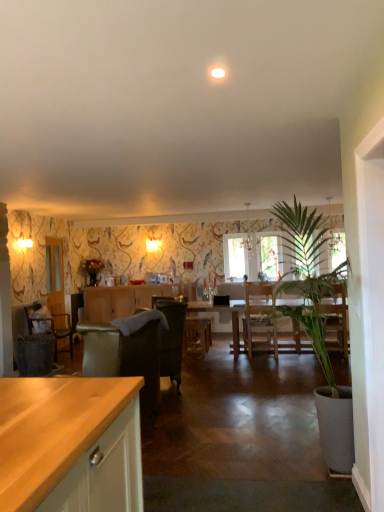
What do you see at coordinates (171, 336) in the screenshot? I see `velvet dark brown armchair at center, placed as the 2th chair when sorted from back to front` at bounding box center [171, 336].

What do you see at coordinates (234, 256) in the screenshot? I see `clear glass window screen at center` at bounding box center [234, 256].

Image resolution: width=384 pixels, height=512 pixels. Describe the element at coordinates (119, 300) in the screenshot. I see `wooden cabinet at center` at that location.

What do you see at coordinates (51, 326) in the screenshot? This screenshot has width=384, height=512. I see `wooden chair at left, positioned as the first chair in left-to-right order` at bounding box center [51, 326].

Describe the element at coordinates (249, 237) in the screenshot. I see `metallic chandelier at center` at that location.

This screenshot has height=512, width=384. Identify the location of clear glass door at left. (56, 286).

Is green leafy plant at right aimed at metallic chandelier at center?

Yes, green leafy plant at right faces towards metallic chandelier at center.

In the scene shown: Is green leafy plant at right to the left of metallic chandelier at center from the viewer's perspective?

Correct, you'll find green leafy plant at right to the left of metallic chandelier at center.

Which is correct: green leafy plant at right is inside metallic chandelier at center, or outside of it?

green leafy plant at right lies outside metallic chandelier at center.

How much distance is there between green leafy plant at right and metallic chandelier at center?

A distance of 3.89 meters exists between green leafy plant at right and metallic chandelier at center.

Consider the image. Which of these two, clear glass window screen at center or wooden dining table at center, stands shorter?

wooden dining table at center.

Between clear glass window screen at center and wooden dining table at center, which one has larger size?

wooden dining table at center.

From a real-world perspective, does clear glass window screen at center stand above wooden dining table at center?

Yes, from a real-world perspective, clear glass window screen at center is over wooden dining table at center

Which of these two, clear glass window screen at center or wooden dining table at center, is thinner?

Thinner between the two is clear glass window screen at center.

From a real-world perspective, is wooden dining table at center physically above wooden chair at left, positioned as the first chair in left-to-right order?

Incorrect, from a real-world perspective, wooden dining table at center is lower than wooden chair at left, positioned as the first chair in left-to-right order.

Who is taller, wooden dining table at center or wooden chair at left, the second chair from the right?

Standing taller between the two is wooden chair at left, the second chair from the right.

Is wooden dining table at center smaller than wooden chair at left, acting as the second chair starting from the front?

No, wooden dining table at center is not smaller than wooden chair at left, acting as the second chair starting from the front.

Is wooden dining table at center not within wooden chair at left, acting as the second chair starting from the front?

wooden dining table at center lies outside wooden chair at left, acting as the second chair starting from the front,'s area.

Is clear glass door at left looking in the opposite direction of green leafy plant at right?

No, clear glass door at left is not facing the opposite direction of green leafy plant at right.

From the image's perspective, is clear glass door at left located beneath green leafy plant at right?

No, from the image's perspective, clear glass door at left is not below green leafy plant at right.

Considering the relative sizes of clear glass door at left and green leafy plant at right in the image provided, is clear glass door at left wider than green leafy plant at right?

In fact, clear glass door at left might be narrower than green leafy plant at right.

Considering the positions of point (246, 260) and point (67, 315), is point (246, 260) closer or farther from the camera than point (67, 315)?

Point (246, 260) is farther from the camera than point (67, 315).

How different are the orientations of clear glass window screen at center and clear glass door at left in degrees?

88.1 degrees.

Is clear glass window screen at center thinner than clear glass door at left?

Incorrect, the width of clear glass window screen at center is not less than that of clear glass door at left.

How much distance is there between clear glass window screen at center and clear glass door at left?

A distance of 9.19 feet exists between clear glass window screen at center and clear glass door at left.

Which is in front, wooden cabinet at center or velvet dark brown armchair at center?

velvet dark brown armchair at center is closer to the camera.

Consider the image. From a real-world perspective, is wooden cabinet at center physically located above or below velvet dark brown armchair at center?

From a real-world perspective, wooden cabinet at center is physically below velvet dark brown armchair at center.

Is wooden cabinet at center at the left side of velvet dark brown armchair at center?

Yes.

Is velvet dark brown armchair at center a part of wooden cabinet at center?

That's incorrect, velvet dark brown armchair at center is not inside wooden cabinet at center.

Does point (179, 336) lie in front of point (233, 271)?

Yes, point (179, 336) is closer to viewer.

Locate an element on the screen. The image size is (384, 512). window screen that is above the velvet dark brown armchair at center, arranged as the 2th chair when viewed from the left (from the image's perspective) is located at coordinates pyautogui.click(x=234, y=256).

Would you say velvet dark brown armchair at center, placed as the 2th chair when sorted from back to front, contains clear glass window screen at center?

No, clear glass window screen at center is not inside velvet dark brown armchair at center, placed as the 2th chair when sorted from back to front.

Based on the photo, how many degrees apart are the facing directions of velvet dark brown armchair at center, the 1th chair in the right-to-left sequence, and clear glass window screen at center?

They differ by 72.3 degrees in their facing directions.

Where is `lamp behind the green leafy plant at right`? lamp behind the green leafy plant at right is located at coordinates (249, 237).

At what (x,y) coordinates should I click in order to perform the action: click on kitchen & dining room table below the clear glass window screen at center (from the image's perspective). Please return your answer as a coordinate pair (x, y). The image size is (384, 512). Looking at the image, I should click on (223, 311).

Considering their positions, is velvet dark brown armchair at center, placed as the 2th chair when sorted from back to front, positioned further to clear glass door at left than clear glass window screen at center?

The object further to clear glass door at left is clear glass window screen at center.

When comparing their distances from clear glass door at left, does green leafy plant at right or wooden dining table at center seem further?

green leafy plant at right lies further to clear glass door at left than the other object.

Based on their spatial positions, is velvet dark brown armchair at center, the 1th chair in the right-to-left sequence, or wooden chair at left, the second chair from the right, closer to metallic chandelier at center?

velvet dark brown armchair at center, the 1th chair in the right-to-left sequence.

Based on their spatial positions, is wooden dining table at center or clear glass window screen at center further from clear glass door at left?

Among the two, clear glass window screen at center is located further to clear glass door at left.

Based on their spatial positions, is clear glass window screen at center or velvet dark brown armchair at center closer to green leafy plant at right?

Based on the image, velvet dark brown armchair at center appears to be nearer to green leafy plant at right.

Looking at this image, which object lies nearer to the anchor point velvet dark brown armchair at center, wooden dining table at center or green leafy plant at right?

The object closer to velvet dark brown armchair at center is wooden dining table at center.

Based on their spatial positions, is velvet dark brown armchair at center or clear glass window screen at center further from metallic chandelier at center?

velvet dark brown armchair at center lies further to metallic chandelier at center than the other object.

Considering their positions, is velvet dark brown armchair at center positioned further to clear glass door at left than wooden cabinet at center?

velvet dark brown armchair at center.

Where is `kitchen & dining room table between green leafy plant at right and clear glass window screen at center from front to back`? Image resolution: width=384 pixels, height=512 pixels. kitchen & dining room table between green leafy plant at right and clear glass window screen at center from front to back is located at coordinates (223, 311).

Locate an element on the screen. The width and height of the screenshot is (384, 512). lamp between green leafy plant at right and clear glass door at left in the front-back direction is located at coordinates (249, 237).

What are the coordinates of `kitchen & dining room table between green leafy plant at right and metallic chandelier at center from front to back` in the screenshot? It's located at tap(223, 311).

You are a GUI agent. You are given a task and a screenshot of the screen. Output one action in this format:
    pyautogui.click(x=<x>, y=<y>)
    Task: Click on the chair between green leafy plant at right and wooden chair at left, positioned as the first chair in left-to-right order, from front to back
    
    Given the screenshot: What is the action you would take?
    pyautogui.click(x=171, y=336)